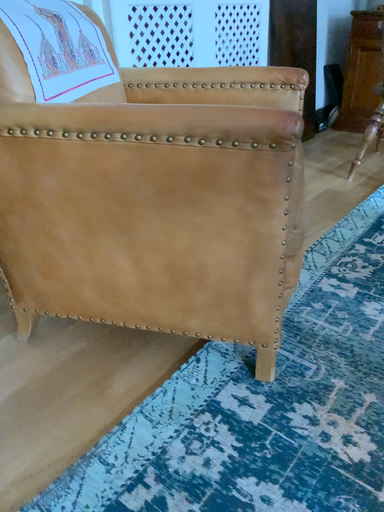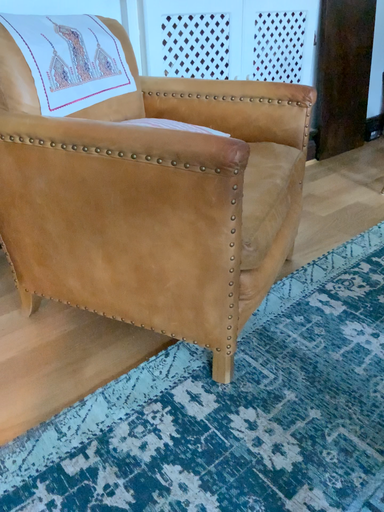
Question: Which way did the camera rotate in the video?

Choices:
 (A) rotated right
 (B) rotated left

Answer: (B)